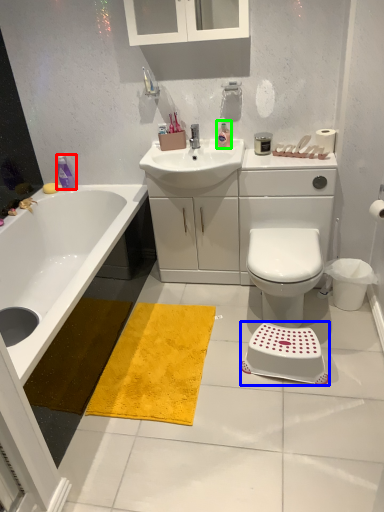
Question: Based on their relative distances, which object is farther from toiletry (highlighted by a red box)? Choose from step stool (highlighted by a blue box) and toiletry (highlighted by a green box).

Choices:
 (A) step stool
 (B) toiletry

Answer: (A)